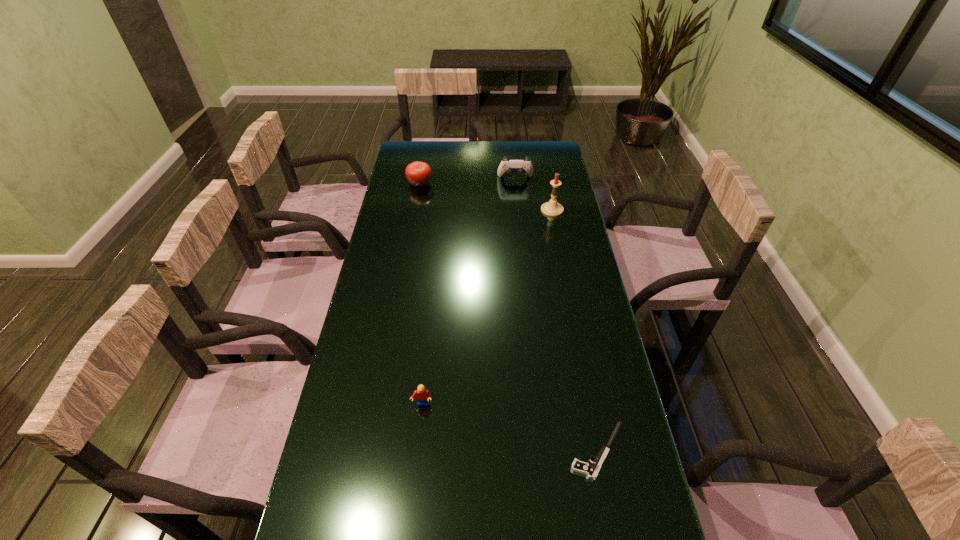
I want to click on candle, so click(x=552, y=208).

This screenshot has width=960, height=540. In order to click on the tallest object in this screenshot , I will do `click(552, 208)`.

This screenshot has width=960, height=540. In order to click on apple in this screenshot , I will do click(x=418, y=173).

The height and width of the screenshot is (540, 960). In order to click on control in this screenshot , I will do `click(509, 166)`.

Locate an element on the screen. This screenshot has height=540, width=960. the fourth tallest object is located at coordinates (422, 394).

Find the location of a particular element. This screenshot has height=540, width=960. the second nearest object is located at coordinates (422, 394).

Where is `pistol`? The width and height of the screenshot is (960, 540). pistol is located at coordinates (591, 471).

You are a GUI agent. You are given a task and a screenshot of the screen. Output one action in this format:
    pyautogui.click(x=<x>, y=<y>)
    Task: Click on the shortest object
    The width and height of the screenshot is (960, 540).
    Given the screenshot: What is the action you would take?
    pyautogui.click(x=591, y=471)

Image resolution: width=960 pixels, height=540 pixels. In order to click on vacant space located 0.150m on the left of the tallest object in this screenshot , I will do `click(504, 210)`.

At what (x,y) coordinates should I click in order to perform the action: click on vacant region located on the front of the leftmost object. Please return your answer as a coordinate pair (x, y). Image resolution: width=960 pixels, height=540 pixels. Looking at the image, I should click on (414, 218).